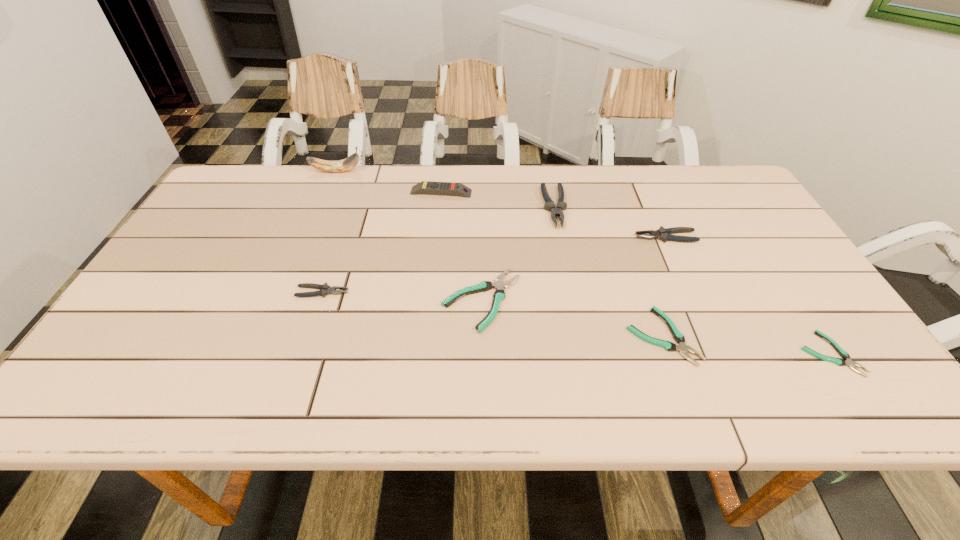
Locate an element on the screen. the fifth pliers from right to left is located at coordinates (499, 295).

Where is `the second shortest object`? the second shortest object is located at coordinates (678, 337).

Where is `the second shortest pliers`? The width and height of the screenshot is (960, 540). the second shortest pliers is located at coordinates pos(678,337).

The image size is (960, 540). Identify the location of the rightmost object. (840, 362).

Locate an element on the screen. The height and width of the screenshot is (540, 960). the smallest teal pliers is located at coordinates (840, 362).

The image size is (960, 540). What are the coordinates of `vacant region located 0.390m on the peel of the tallest object` in the screenshot? It's located at (483, 171).

Identify the location of free space located at the gripping part of the third pliers from left to right. (564, 252).

I want to click on free space located 0.060m on the right of the remote control, so click(492, 192).

You are a GUI agent. You are given a task and a screenshot of the screen. Output one action in this format:
    pyautogui.click(x=<x>, y=<y>)
    Task: Click on the free location located at the gripping part of the fourth tallest object
    
    Given the screenshot: What is the action you would take?
    pyautogui.click(x=591, y=237)

Find the location of `free space located at the gripping part of the fourth tallest object`. free space located at the gripping part of the fourth tallest object is located at coordinates (555, 237).